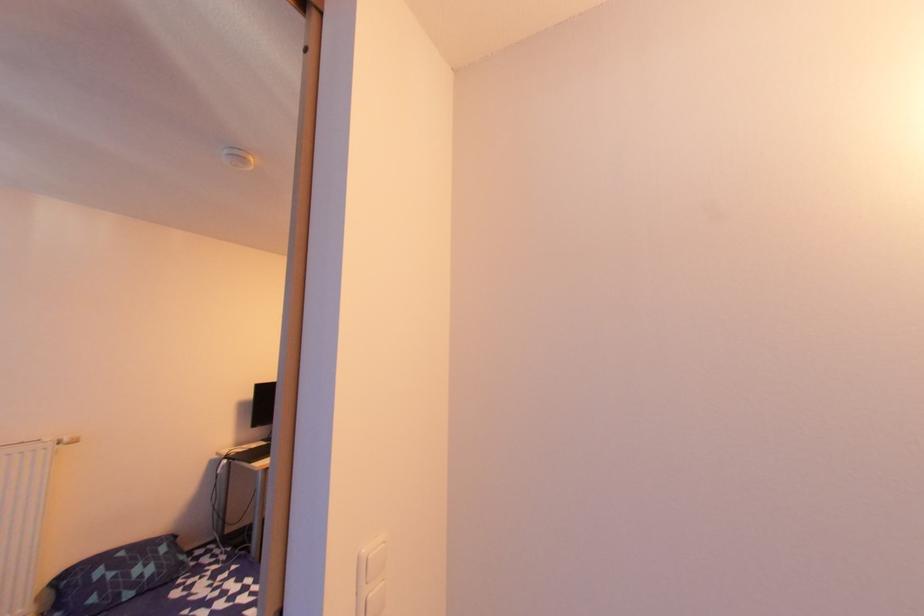
Identify the location of white radiator knob. (66, 442).